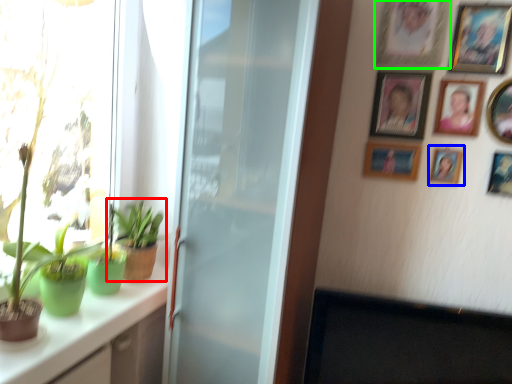
Question: Estimate the real-world distances between objects in this image. Which object is farther from houseplant (highlighted by a red box), picture frame (highlighted by a blue box) or picture frame (highlighted by a green box)?

Choices:
 (A) picture frame
 (B) picture frame

Answer: (B)